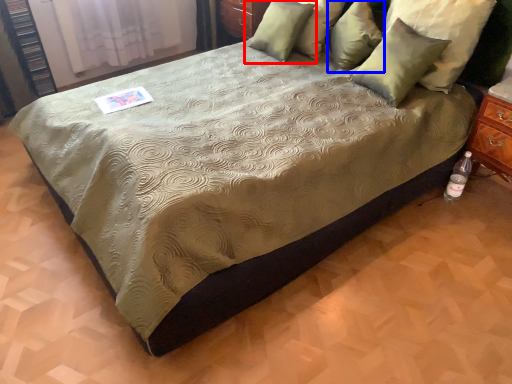
Question: Which object appears farthest to the camera in this image, pillow (highlighted by a red box) or pillow (highlighted by a blue box)?

Choices:
 (A) pillow
 (B) pillow

Answer: (A)